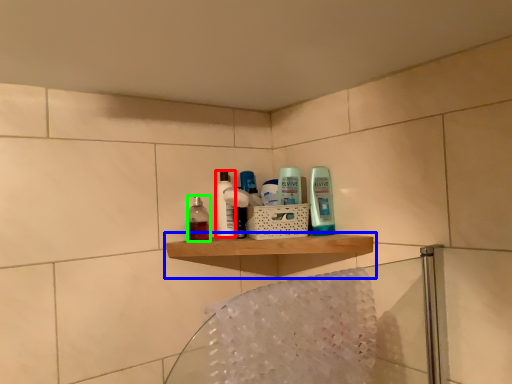
Question: Which is farther away from toiletry (highlighted by a red box)? shelf (highlighted by a blue box) or mouthwash (highlighted by a green box)?

Choices:
 (A) shelf
 (B) mouthwash

Answer: (A)